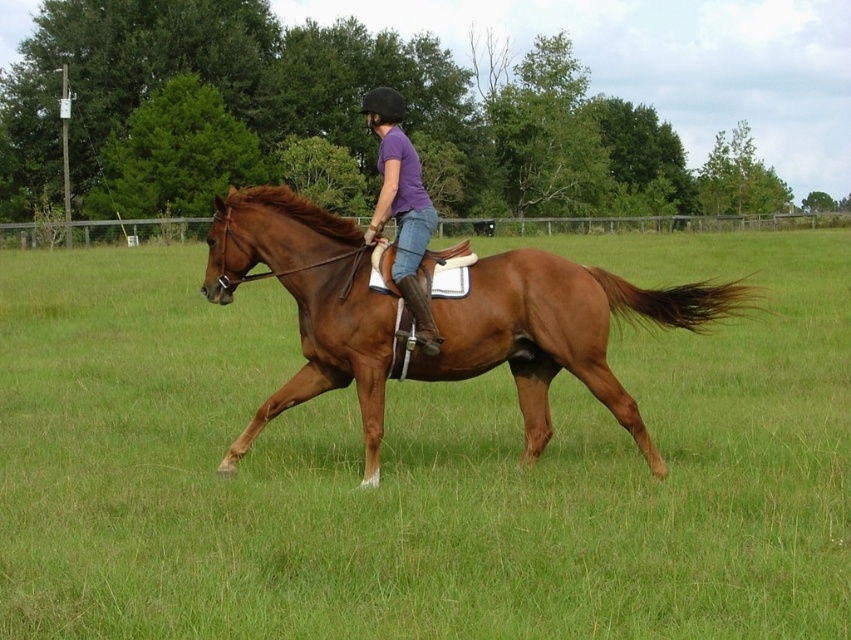
Can you confirm if brown leather horse at center is positioned to the left of purple cotton shirt at center?

Incorrect, brown leather horse at center is not on the left side of purple cotton shirt at center.

Is brown leather horse at center smaller than purple cotton shirt at center?

Yes, brown leather horse at center is smaller than purple cotton shirt at center.

This screenshot has height=640, width=851. I want to click on brown leather horse at center, so click(x=420, y=465).

Image resolution: width=851 pixels, height=640 pixels. In order to click on brown leather horse at center in this screenshot , I will do `click(420, 465)`.

Does brown leather horse at center appear under brown glossy horse at center?

Yes.

Does brown leather horse at center have a lesser height compared to brown glossy horse at center?

No.

The image size is (851, 640). What do you see at coordinates (420, 465) in the screenshot?
I see `brown leather horse at center` at bounding box center [420, 465].

Where is `brown leather horse at center`? brown leather horse at center is located at coordinates (420, 465).

Which is more to the right, brown glossy horse at center or purple cotton shirt at center?

brown glossy horse at center is more to the right.

In order to click on brown glossy horse at center in this screenshot , I will do `click(558, 332)`.

Identify the location of brown glossy horse at center. (558, 332).